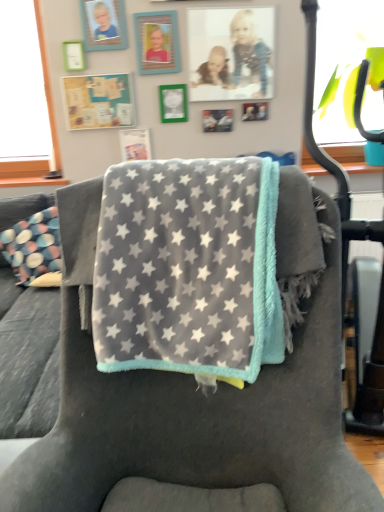
Question: Is matte plastic picture frame at upper center, the second picture frame in the right-to-left sequence, positioned beyond the bounds of gray plush blanket at center?

Choices:
 (A) no
 (B) yes

Answer: (B)

Question: From a real-world perspective, is matte plastic picture frame at upper center, the second picture frame in the right-to-left sequence, under gray plush blanket at center?

Choices:
 (A) yes
 (B) no

Answer: (B)

Question: Does matte plastic picture frame at upper center, the second picture frame in the right-to-left sequence, touch gray plush blanket at center?

Choices:
 (A) yes
 (B) no

Answer: (B)

Question: Can you confirm if matte plastic picture frame at upper center, the second picture frame in the right-to-left sequence, is positioned to the left of gray plush blanket at center?

Choices:
 (A) no
 (B) yes

Answer: (A)

Question: Is matte plastic picture frame at upper center, the 6th picture frame in the left-to-right sequence, positioned before gray plush blanket at center?

Choices:
 (A) yes
 (B) no

Answer: (B)

Question: Does matte plastic picture frame at upper center, the second picture frame in the right-to-left sequence, have a larger size compared to gray plush blanket at center?

Choices:
 (A) yes
 (B) no

Answer: (B)

Question: Could you tell me if metallic silver photo frame at upper center, which is counted as the seventh picture frame, starting from the left, is facing gray plush blanket at center?

Choices:
 (A) no
 (B) yes

Answer: (B)

Question: Is metallic silver photo frame at upper center, which is counted as the seventh picture frame, starting from the left, located outside gray plush blanket at center?

Choices:
 (A) no
 (B) yes

Answer: (B)

Question: Considering the relative sizes of metallic silver photo frame at upper center, the first picture frame from the right, and gray plush blanket at center in the image provided, is metallic silver photo frame at upper center, the first picture frame from the right, bigger than gray plush blanket at center?

Choices:
 (A) yes
 (B) no

Answer: (B)

Question: Is metallic silver photo frame at upper center, the first picture frame from the right, in front of gray plush blanket at center?

Choices:
 (A) yes
 (B) no

Answer: (B)

Question: Is metallic silver photo frame at upper center, which is counted as the seventh picture frame, starting from the left, wider than gray plush blanket at center?

Choices:
 (A) yes
 (B) no

Answer: (B)

Question: Does metallic silver photo frame at upper center, which is counted as the seventh picture frame, starting from the left, lie behind gray plush blanket at center?

Choices:
 (A) no
 (B) yes

Answer: (B)

Question: Can you confirm if green matte picture frame at upper left, the 7th picture frame viewed from the right, is positioned to the left of matte black picture frame at center, placed as the 3th picture frame when sorted from right to left?

Choices:
 (A) no
 (B) yes

Answer: (B)